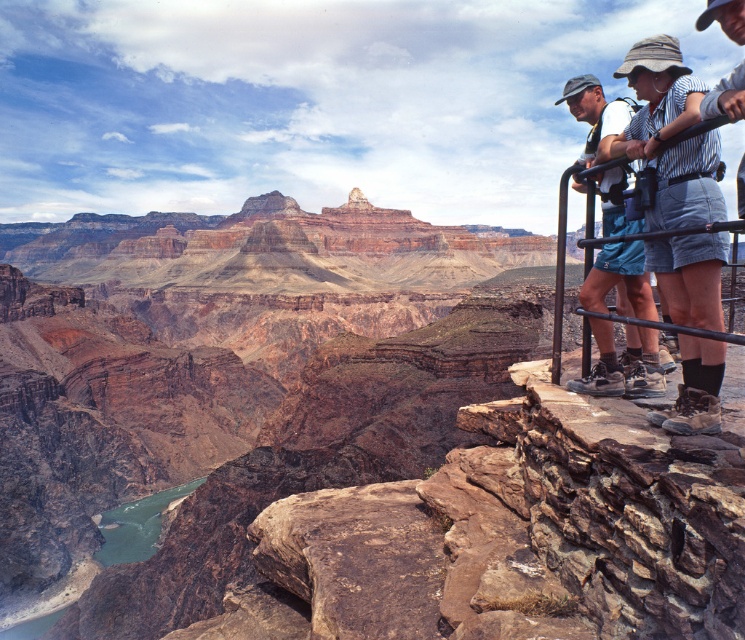
In order to click on denim shorts at center in this screenshot , I will do `click(659, 99)`.

Consider the image. Who is more distant from viewer, (723, 100) or (568, 93)?

The point (568, 93) is more distant.

Where is `denim shorts at center`? Image resolution: width=745 pixels, height=640 pixels. denim shorts at center is located at coordinates (659, 99).

Does rustic rock canyon at upper center appear on the right side of denim shorts at center?

Indeed, rustic rock canyon at upper center is positioned on the right side of denim shorts at center.

Can you confirm if rustic rock canyon at upper center is thinner than denim shorts at center?

In fact, rustic rock canyon at upper center might be wider than denim shorts at center.

Find the location of a particular element. The width and height of the screenshot is (745, 640). rustic rock canyon at upper center is located at coordinates (329, 448).

Which is more to the left, rustic rock canyon at upper center or matte blue shorts at right?

From the viewer's perspective, matte blue shorts at right appears more on the left side.

Can you confirm if rustic rock canyon at upper center is positioned above matte blue shorts at right?

Incorrect, rustic rock canyon at upper center is not positioned above matte blue shorts at right.

Does point (203, 600) lie behind point (608, 360)?

Yes, it is behind point (608, 360).

You are a GUI agent. You are given a task and a screenshot of the screen. Output one action in this format:
    pyautogui.click(x=<x>, y=<y>)
    Task: Click on the rustic rock canyon at upper center
    This screenshot has width=745, height=640.
    Given the screenshot: What is the action you would take?
    pyautogui.click(x=329, y=448)